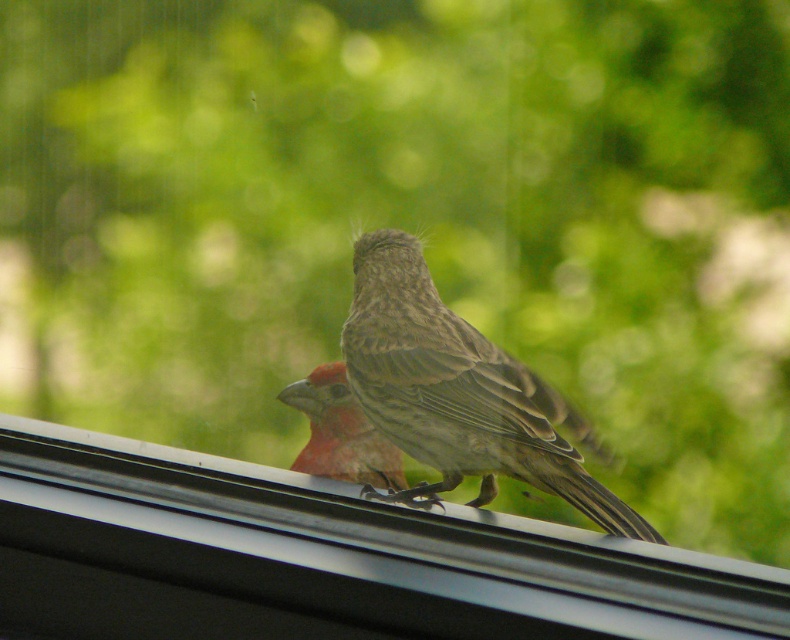
Between black plastic window sill at upper center and brown speckled sparrow at center, which one is positioned higher?

brown speckled sparrow at center

What do you see at coordinates (374, 548) in the screenshot? I see `black plastic window sill at upper center` at bounding box center [374, 548].

Where is `black plastic window sill at upper center`? This screenshot has width=790, height=640. black plastic window sill at upper center is located at coordinates (374, 548).